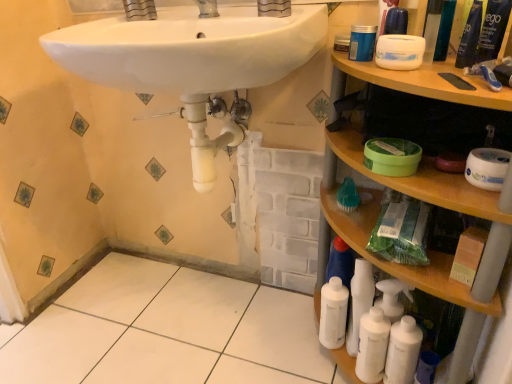
What are the coordinates of `vacant space in front of blue glossy tube at upper right, the 2th cleaning product positioned from the left` in the screenshot? It's located at (468, 80).